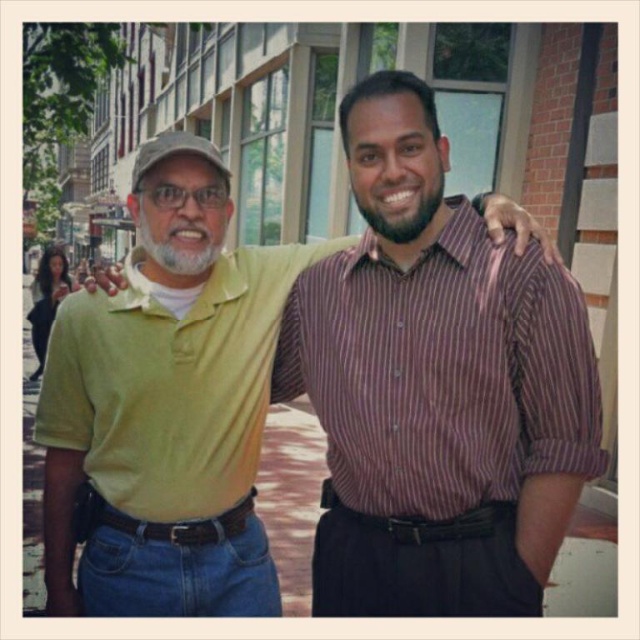
Question: Does green cotton polo shirt at center have a greater width compared to purple striped shirt at right?

Choices:
 (A) no
 (B) yes

Answer: (B)

Question: Can you confirm if green cotton polo shirt at center is positioned to the left of purple striped shirt at right?

Choices:
 (A) no
 (B) yes

Answer: (B)

Question: Is green cotton polo shirt at center behind purple striped shirt at right?

Choices:
 (A) no
 (B) yes

Answer: (B)

Question: Which point appears closest to the camera in this image?

Choices:
 (A) (237, 461)
 (B) (570, 308)

Answer: (B)